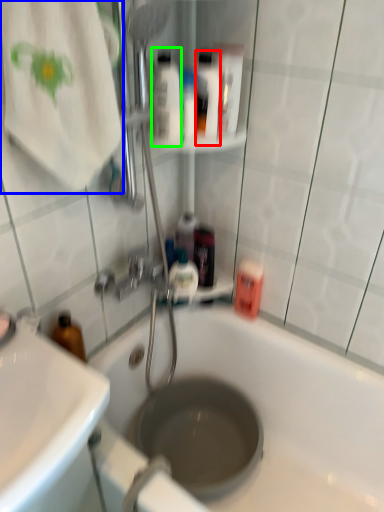
Question: Considering the real-world distances, which object is closest to mouthwash (highlighted by a red box)? beach towel (highlighted by a blue box) or mouthwash (highlighted by a green box).

Choices:
 (A) beach towel
 (B) mouthwash

Answer: (B)